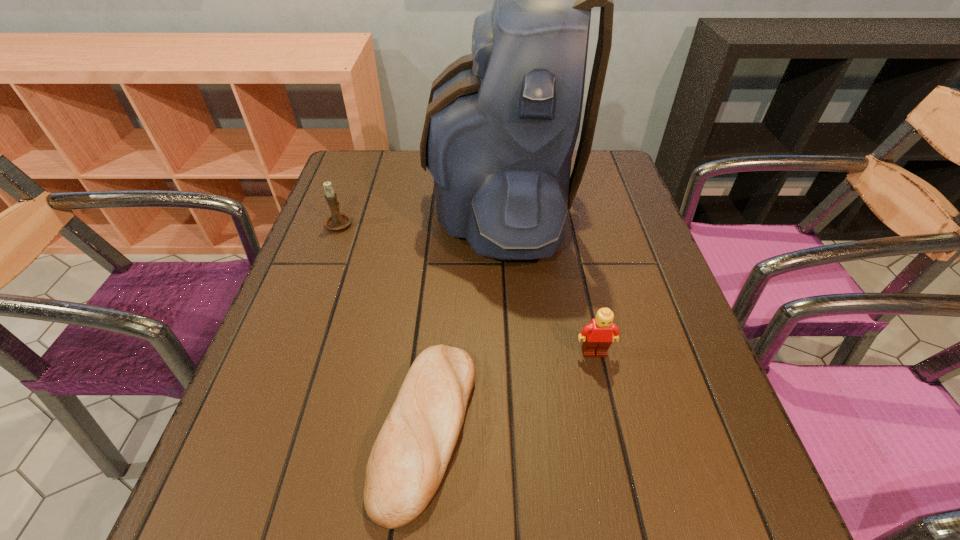
Locate an element on the screen. Image resolution: width=960 pixels, height=540 pixels. the tallest object is located at coordinates (501, 125).

At what (x,y) coordinates should I click in order to perform the action: click on candle holder. Please return your answer as a coordinate pair (x, y). Looking at the image, I should click on (337, 221).

Locate an element on the screen. The width and height of the screenshot is (960, 540). Lego is located at coordinates (598, 335).

Where is `the shortest object`? The width and height of the screenshot is (960, 540). the shortest object is located at coordinates (408, 460).

Where is `vacant region located 0.180m at the front pocket of the backpack`? This screenshot has width=960, height=540. vacant region located 0.180m at the front pocket of the backpack is located at coordinates (361, 205).

The height and width of the screenshot is (540, 960). Find the location of `vacant space situated 0.090m at the front pocket of the backpack`. vacant space situated 0.090m at the front pocket of the backpack is located at coordinates (396, 205).

Where is `vacant space situated 0.150m at the front pocket of the backpack`? Image resolution: width=960 pixels, height=540 pixels. vacant space situated 0.150m at the front pocket of the backpack is located at coordinates (372, 205).

You are a GUI agent. You are given a task and a screenshot of the screen. Output one action in this format:
    pyautogui.click(x=<x>, y=<y>)
    Task: Click on the blank space located 0.050m on the side of the leftmost object with the handle
    
    Given the screenshot: What is the action you would take?
    pyautogui.click(x=348, y=200)

Where is `free space located on the side of the leftmost object with the handle`? free space located on the side of the leftmost object with the handle is located at coordinates (365, 152).

Identify the location of vacant space situated on the side of the leftmost object with the handle. (351, 190).